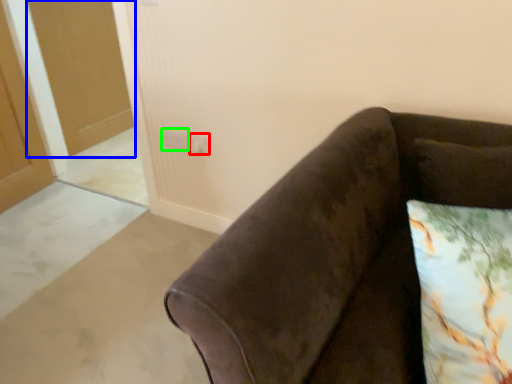
Question: Which object is the farthest from electric outlet (highlighted by a red box)? Choose among these: glass door (highlighted by a blue box) or electric outlet (highlighted by a green box).

Choices:
 (A) glass door
 (B) electric outlet

Answer: (A)